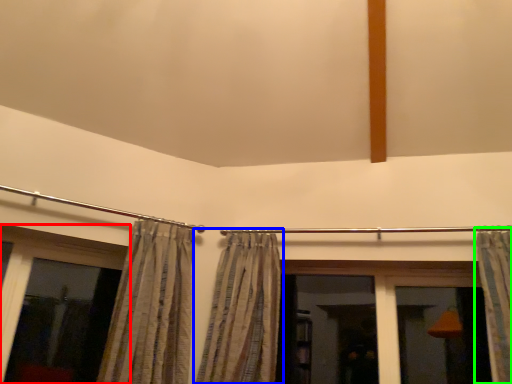
Question: Estimate the real-world distances between objects in this image. Which object is closer to window (highlighted by a red box), curtain (highlighted by a blue box) or curtain (highlighted by a green box)?

Choices:
 (A) curtain
 (B) curtain

Answer: (A)